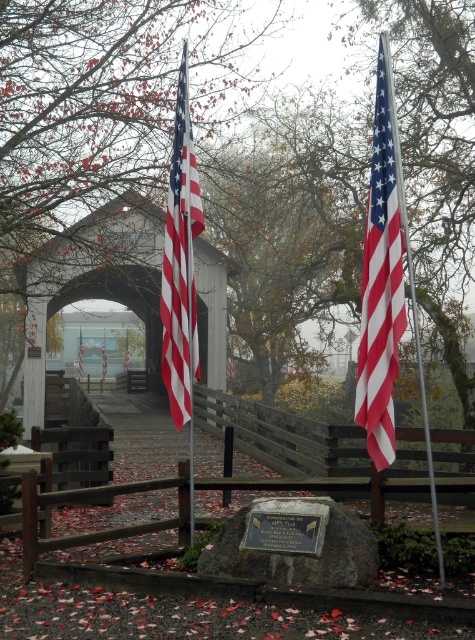
Question: Among these objects, which one is farthest from the camera?

Choices:
 (A) red-white striped flag at center
 (B) matte fabric flag at center

Answer: (A)

Question: Can you confirm if matte fabric flag at center is thinner than red-white striped flag at center?

Choices:
 (A) yes
 (B) no

Answer: (B)

Question: Can you confirm if matte fabric flag at center is positioned to the right of red-white striped flag at center?

Choices:
 (A) yes
 (B) no

Answer: (A)

Question: Does matte fabric flag at center come in front of red-white striped flag at center?

Choices:
 (A) yes
 (B) no

Answer: (A)

Question: Which of the following is the farthest from the observer?

Choices:
 (A) (164, 365)
 (B) (387, 275)

Answer: (A)